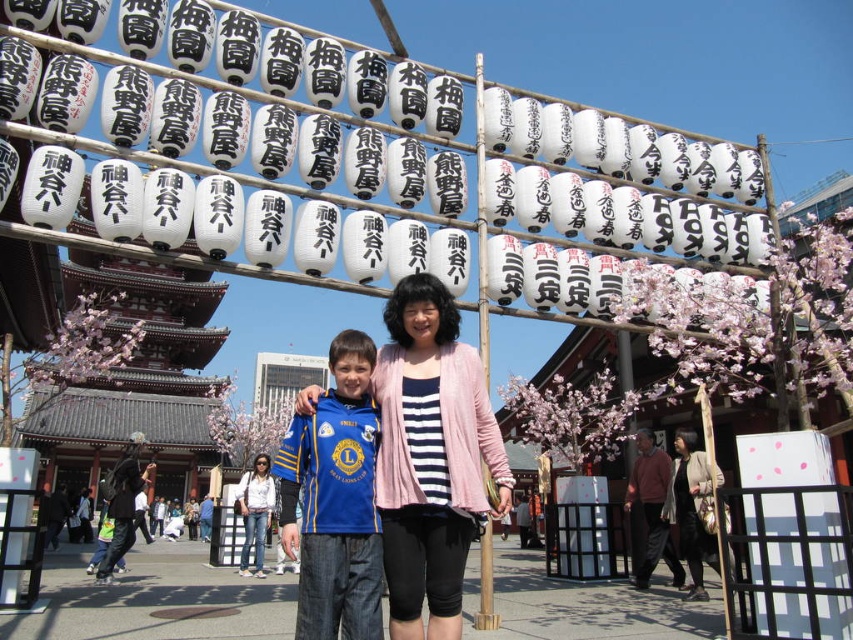
Question: Which point is closer to the camera taking this photo?

Choices:
 (A) (364, 490)
 (B) (381, 397)
 (C) (265, 497)
 (D) (688, 483)

Answer: (A)

Question: Among these points, which one is farthest from the camera?

Choices:
 (A) (241, 493)
 (B) (712, 545)

Answer: (A)

Question: Which object is positioned closest to the denim jacket at lower center?

Choices:
 (A) blue jersey at center
 (B) pink fabric at center
 (C) matte black jacket at center

Answer: (A)

Question: Observing the image, what is the correct spatial positioning of pink fabric at center in reference to denim jacket at lower center?

Choices:
 (A) above
 (B) below

Answer: (A)

Question: Does pink fabric at center have a larger size compared to denim jacket at lower center?

Choices:
 (A) no
 (B) yes

Answer: (B)

Question: In this image, where is blue jersey at center located relative to denim jacket at lower center?

Choices:
 (A) above
 (B) below

Answer: (A)